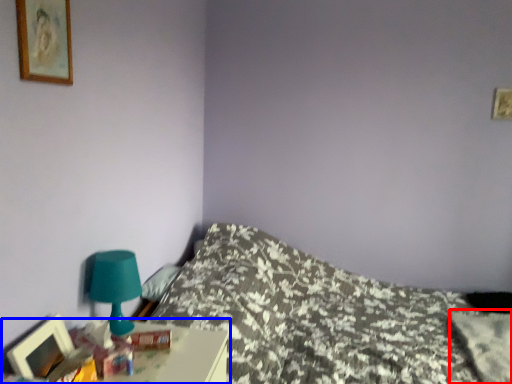
Question: Which object appears closest to the camera in this image, pillow (highlighted by a red box) or nightstand (highlighted by a blue box)?

Choices:
 (A) pillow
 (B) nightstand

Answer: (B)